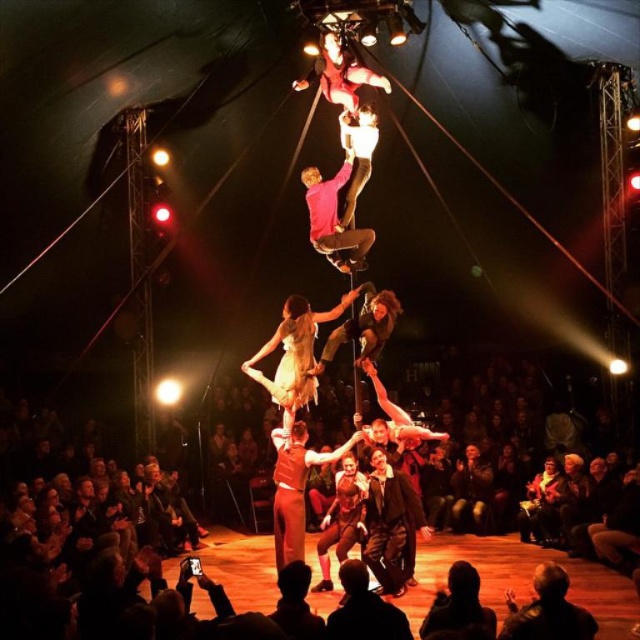
Does point (76, 600) come in front of point (474, 605)?

No.

Looking at this image, is dark clothing audience at lower center positioned in front of dark hair at lower center?

No, it is not.

Which is behind, point (499, 465) or point (458, 609)?

Point (499, 465)

Where is `dark clothing audience at lower center`? dark clothing audience at lower center is located at coordinates (124, 522).

Is leather jacket at lower right behind dark hair at lower center?

Yes, it is behind dark hair at lower center.

Does leather jacket at lower right appear over dark hair at lower center?

Indeed, leather jacket at lower right is positioned over dark hair at lower center.

This screenshot has width=640, height=640. What do you see at coordinates (547, 611) in the screenshot? I see `leather jacket at lower right` at bounding box center [547, 611].

You are a GUI agent. You are given a task and a screenshot of the screen. Output one action in this format:
    pyautogui.click(x=<x>, y=<y>)
    Task: Click on the leather jacket at lower right
    This screenshot has height=640, width=640.
    Given the screenshot: What is the action you would take?
    pyautogui.click(x=547, y=611)

Can you confirm if dark clothing audience at lower center is positioned to the right of leather jacket at lower right?

In fact, dark clothing audience at lower center is to the left of leather jacket at lower right.

Can you confirm if dark clothing audience at lower center is thinner than leather jacket at lower right?

In fact, dark clothing audience at lower center might be wider than leather jacket at lower right.

Is point (129, 566) positioned after point (552, 621)?

Yes, point (129, 566) is behind point (552, 621).

At what (x,y) coordinates should I click in order to perform the action: click on dark clothing audience at lower center. Please return your answer as a coordinate pair (x, y). The image size is (640, 640). Looking at the image, I should click on (124, 522).